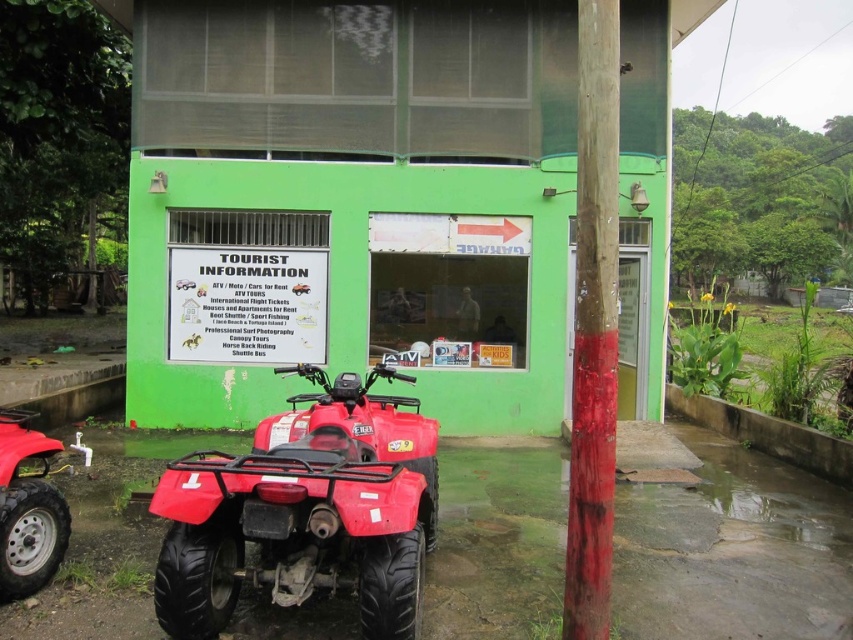
Question: Does shiny red quad bike at lower left have a smaller size compared to smooth wooden pole at right?

Choices:
 (A) yes
 (B) no

Answer: (B)

Question: Which point is farther to the camera?

Choices:
 (A) (247, 481)
 (B) (602, 484)

Answer: (A)

Question: Among these points, which one is nearest to the camera?

Choices:
 (A) (593, 346)
 (B) (189, 522)

Answer: (A)

Question: Is shiny red quad bike at lower left smaller than smooth wooden pole at right?

Choices:
 (A) yes
 (B) no

Answer: (B)

Question: Which point is farther to the camera?

Choices:
 (A) click(x=582, y=104)
 (B) click(x=379, y=596)

Answer: (A)

Question: In this image, where is shiny red quad bike at lower left located relative to smooth wooden pole at right?

Choices:
 (A) below
 (B) above

Answer: (A)